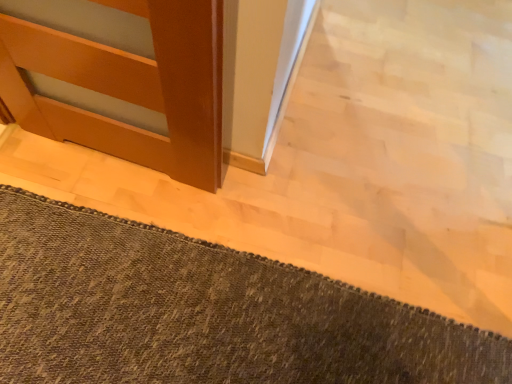
Where is `vacant location below matte wood door at left (from a real-world perspective)`? vacant location below matte wood door at left (from a real-world perspective) is located at coordinates (115, 161).